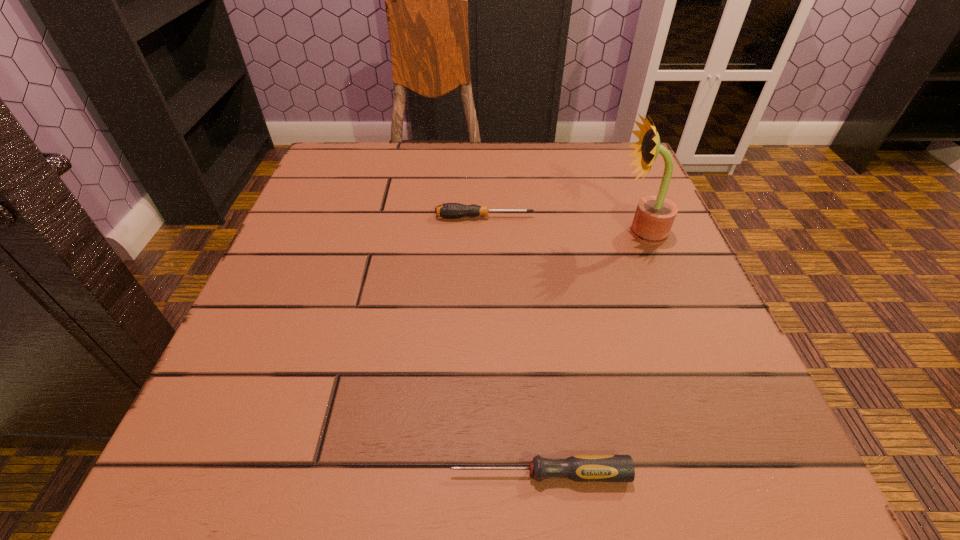
Locate an element on the screen. free space between the farther screwdriver and the nearest object is located at coordinates (512, 345).

Identify the location of free space between the tallest object and the farther screwdriver. The width and height of the screenshot is (960, 540). (563, 225).

Find the location of a particular element. The width and height of the screenshot is (960, 540). free space that is in between the nearer screwdriver and the farther screwdriver is located at coordinates (512, 345).

You are a GUI agent. You are given a task and a screenshot of the screen. Output one action in this format:
    pyautogui.click(x=<x>, y=<y>)
    Task: Click on the free area in between the farther screwdriver and the sunflower
    The height and width of the screenshot is (540, 960).
    Given the screenshot: What is the action you would take?
    pyautogui.click(x=563, y=225)

What are the coordinates of `free area in between the farther screwdriver and the nearer screwdriver` in the screenshot? It's located at (512, 345).

This screenshot has height=540, width=960. What are the coordinates of `vacant space that's between the sunflower and the nearest object` in the screenshot? It's located at (590, 354).

Find the location of a particular element. This screenshot has width=960, height=540. free space between the nearest object and the farther screwdriver is located at coordinates (512, 345).

At what (x,y) coordinates should I click in order to perform the action: click on vacant area between the farther screwdriver and the nearer screwdriver. Please return your answer as a coordinate pair (x, y). The width and height of the screenshot is (960, 540). Looking at the image, I should click on [512, 345].

Identify the location of free area in between the rightmost object and the nearest object. (590, 354).

Locate an element on the screen. object identified as the closest to the tallest object is located at coordinates (448, 210).